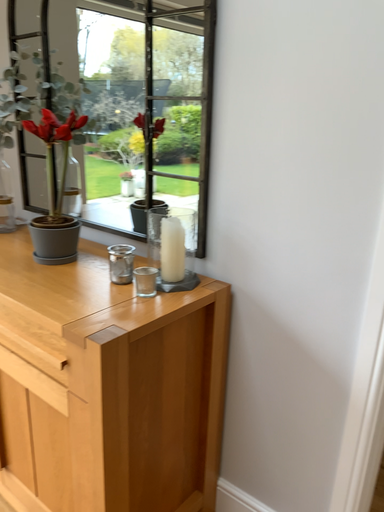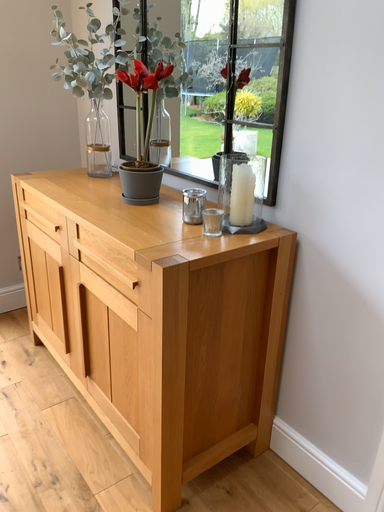
Question: Which way did the camera rotate in the video?

Choices:
 (A) rotated right
 (B) rotated left

Answer: (B)